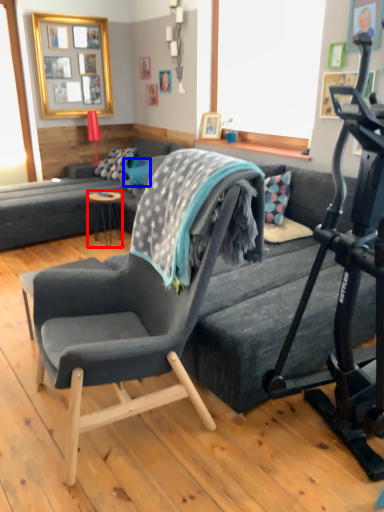
Question: Which point is closer to the camera, table (highlighted by a red box) or pillow (highlighted by a blue box)?

Choices:
 (A) table
 (B) pillow

Answer: (A)